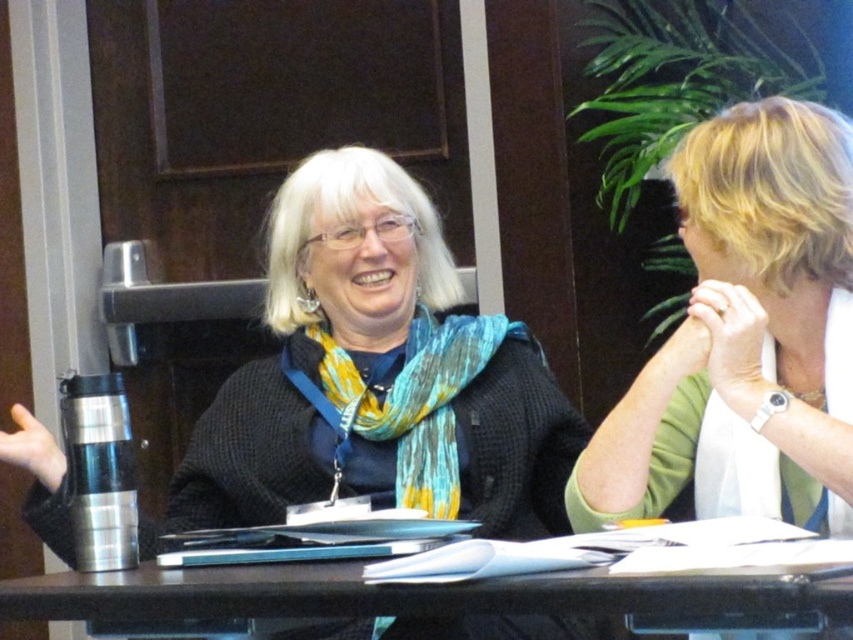
Is point (363, 572) in front of point (358, 396)?

That is True.

Between point (840, 557) and point (431, 396), which one is positioned behind?

Point (431, 396)

Where is `black plastic table at center`? The width and height of the screenshot is (853, 640). black plastic table at center is located at coordinates (461, 582).

Can you confirm if white fabric at upper right is positioned to the right of black plastic table at center?

Yes, white fabric at upper right is to the right of black plastic table at center.

Can you confirm if white fabric at upper right is positioned to the left of black plastic table at center?

Incorrect, white fabric at upper right is not on the left side of black plastic table at center.

The width and height of the screenshot is (853, 640). I want to click on white fabric at upper right, so click(746, 336).

Identify the location of white fabric at upper right. This screenshot has width=853, height=640. (746, 336).

Can you confirm if white fabric at upper right is positioned to the left of blue and yellow woven scarf at center?

Incorrect, white fabric at upper right is not on the left side of blue and yellow woven scarf at center.

Is white fabric at upper right bigger than blue and yellow woven scarf at center?

Indeed, white fabric at upper right has a larger size compared to blue and yellow woven scarf at center.

Is point (619, 452) behind point (431, 444)?

No, it is in front of (431, 444).

The image size is (853, 640). In order to click on white fabric at upper right in this screenshot , I will do `click(746, 336)`.